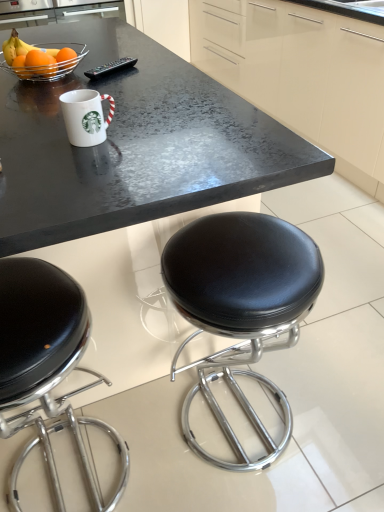
Question: Is metallic wire basket at upper left facing away from black leather stool at lower left?

Choices:
 (A) no
 (B) yes

Answer: (A)

Question: Is metallic wire basket at upper left next to black leather stool at lower left?

Choices:
 (A) yes
 (B) no

Answer: (B)

Question: Can you confirm if metallic wire basket at upper left is wider than black leather stool at lower left?

Choices:
 (A) yes
 (B) no

Answer: (B)

Question: Can you confirm if metallic wire basket at upper left is shorter than black leather stool at lower left?

Choices:
 (A) yes
 (B) no

Answer: (A)

Question: Is the position of metallic wire basket at upper left less distant than that of black leather stool at lower left?

Choices:
 (A) yes
 (B) no

Answer: (B)

Question: Is matte orange at upper left, which ranks as the 1th orange in front-to-back order, in front of or behind metallic wire basket at upper left in the image?

Choices:
 (A) behind
 (B) front

Answer: (A)

Question: In terms of size, does matte orange at upper left, which ranks as the 1th orange in front-to-back order, appear bigger or smaller than metallic wire basket at upper left?

Choices:
 (A) big
 (B) small

Answer: (B)

Question: Considering the positions of matte orange at upper left, which ranks as the 1th orange in front-to-back order, and metallic wire basket at upper left in the image, is matte orange at upper left, which ranks as the 1th orange in front-to-back order, taller or shorter than metallic wire basket at upper left?

Choices:
 (A) short
 (B) tall

Answer: (B)

Question: From the image's perspective, relative to metallic wire basket at upper left, is matte orange at upper left, the second orange when ordered from back to front, above or below?

Choices:
 (A) below
 (B) above

Answer: (A)

Question: Would you say black leather stool at lower left is to the left or to the right of matte orange at upper left, which ranks as the 1th orange in front-to-back order, in the picture?

Choices:
 (A) left
 (B) right

Answer: (B)

Question: Which is correct: black leather stool at lower left is inside matte orange at upper left, which ranks as the 1th orange in front-to-back order, or outside of it?

Choices:
 (A) inside
 (B) outside

Answer: (B)

Question: From a real-world perspective, is black leather stool at lower left above or below matte orange at upper left, which ranks as the 1th orange in front-to-back order?

Choices:
 (A) above
 (B) below

Answer: (B)

Question: Considering the positions of point (29, 284) and point (44, 71), is point (29, 284) closer or farther from the camera than point (44, 71)?

Choices:
 (A) closer
 (B) farther

Answer: (A)

Question: Is metallic wire basket at upper left in front of or behind matte orange at upper left, the second orange when ordered from back to front, in the image?

Choices:
 (A) behind
 (B) front

Answer: (B)

Question: From a real-world perspective, is metallic wire basket at upper left above or below matte orange at upper left, which ranks as the 1th orange in front-to-back order?

Choices:
 (A) above
 (B) below

Answer: (B)